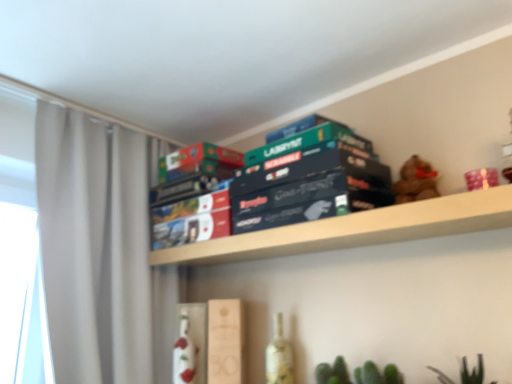
Question: From the image's perspective, relative to green matte board game box at center, the 3th paperback book from the bottom, is white glossy bottle at center, which is the second bottle in right-to-left order, above or below?

Choices:
 (A) above
 (B) below

Answer: (B)

Question: Visually, is white glossy bottle at center, which is the second bottle in right-to-left order, positioned to the left or to the right of green matte board game box at center, the 3th paperback book from the bottom?

Choices:
 (A) right
 (B) left

Answer: (B)

Question: Which is farther from the green matte board game at center, marked as the 3th paperback book in a top-to-bottom arrangement?

Choices:
 (A) dark blue cardboard game box at center
 (B) wooden shelf at upper center
 (C) green matte board game box at center, the 2th paperback book from the top
 (D) white glass bottle at lower center, which is the 1th bottle from right to left
 (E) white glossy bottle at center, the 1th bottle in the left-to-right sequence

Answer: (E)

Question: Which object is positioned closest to the dark blue cardboard game box at center?

Choices:
 (A) white glossy bottle at center, which is the second bottle in right-to-left order
 (B) wooden shelf at upper center
 (C) green matte board game box at center, the 2th paperback book from the top
 (D) white glass bottle at lower center, which is the 1th bottle from right to left
 (E) green matte board game at upper center, which ranks as the 4th paperback book in bottom-to-top order

Answer: (E)